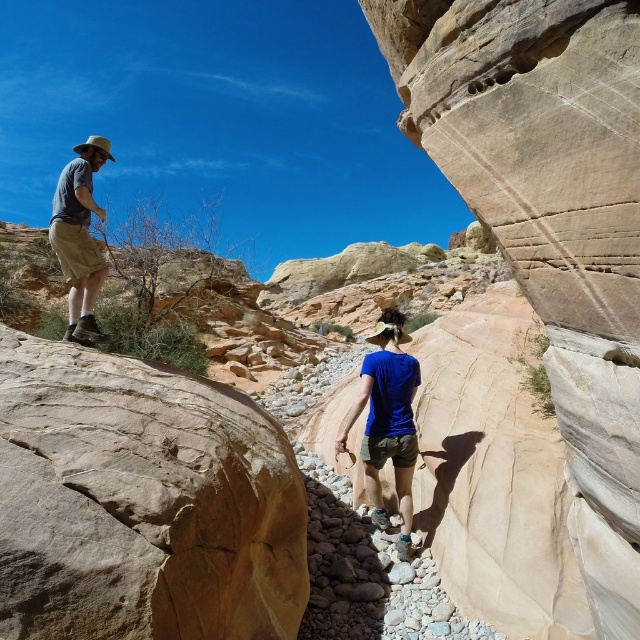
Does point (257, 548) come farther from viewer compared to point (380, 452)?

No, it is in front of (380, 452).

The width and height of the screenshot is (640, 640). What do you see at coordinates (141, 502) in the screenshot?
I see `smooth beige rock at lower left` at bounding box center [141, 502].

Where is `smooth beige rock at lower left`? This screenshot has width=640, height=640. smooth beige rock at lower left is located at coordinates (141, 502).

Which is above, blue cotton shirt at center or matte gray shirt at left?

Positioned higher is matte gray shirt at left.

Does blue cotton shirt at center appear on the right side of matte gray shirt at left?

Indeed, blue cotton shirt at center is positioned on the right side of matte gray shirt at left.

I want to click on blue cotton shirt at center, so click(x=387, y=420).

Does smooth beige rock at lower left appear on the left side of matte gray shirt at left?

In fact, smooth beige rock at lower left is to the right of matte gray shirt at left.

This screenshot has width=640, height=640. Describe the element at coordinates (141, 502) in the screenshot. I see `smooth beige rock at lower left` at that location.

The width and height of the screenshot is (640, 640). I want to click on smooth beige rock at lower left, so click(x=141, y=502).